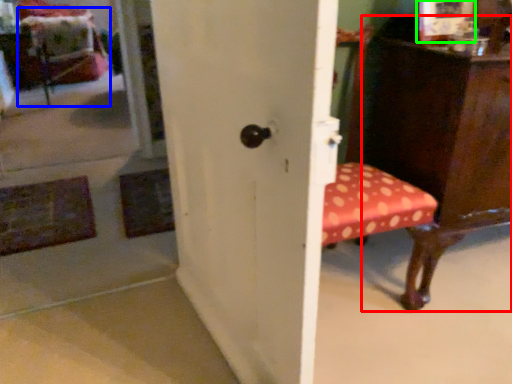
Question: Estimate the real-world distances between objects in this image. Which object is closer to furniture (highlighted by a red box), swivel chair (highlighted by a blue box) or picture frame (highlighted by a green box)?

Choices:
 (A) swivel chair
 (B) picture frame

Answer: (B)